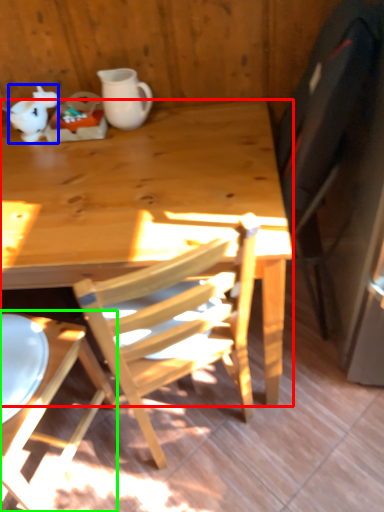
Question: Which object is the farthest from desk (highlighted by a red box)? Choose among these: teapot (highlighted by a blue box) or chair (highlighted by a green box).

Choices:
 (A) teapot
 (B) chair

Answer: (A)